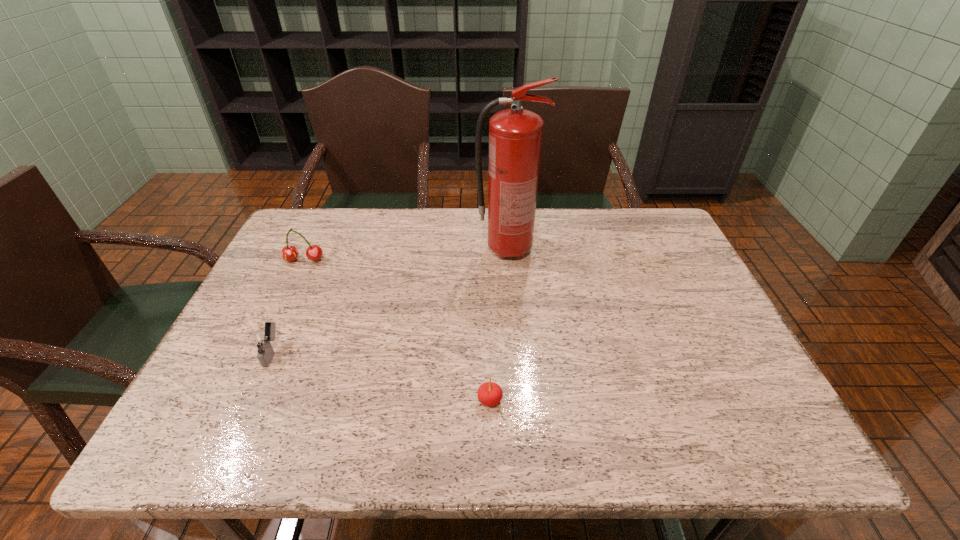
Identify the location of unoccupied area between the third shortest object and the fire extinguisher. (406, 255).

Locate an element on the screen. The height and width of the screenshot is (540, 960). vacant area that lies between the nearer cherry and the tallest object is located at coordinates (499, 325).

Where is `vacant space that is in between the fire extinguisher and the igniter`? This screenshot has height=540, width=960. vacant space that is in between the fire extinguisher and the igniter is located at coordinates (390, 301).

Where is `empty location between the shorter cherry and the left cherry`? This screenshot has height=540, width=960. empty location between the shorter cherry and the left cherry is located at coordinates [396, 330].

At what (x,y) coordinates should I click in order to perform the action: click on vacant space in between the taller cherry and the nearer cherry. Please return your answer as a coordinate pair (x, y). Looking at the image, I should click on (396, 330).

The width and height of the screenshot is (960, 540). Identify the location of vacant point located between the nearer cherry and the igniter. (381, 376).

This screenshot has height=540, width=960. Identify the location of free spot between the tallest object and the shorter cherry. (499, 325).

Where is `free space that is in between the shorter cherry and the tallest object`? free space that is in between the shorter cherry and the tallest object is located at coordinates (499, 325).

Locate an element on the screen. Image resolution: width=960 pixels, height=540 pixels. vacant space in between the right cherry and the fire extinguisher is located at coordinates (499, 325).

This screenshot has height=540, width=960. Find the location of `object that ranks as the second closest to the tallest object`. object that ranks as the second closest to the tallest object is located at coordinates (289, 253).